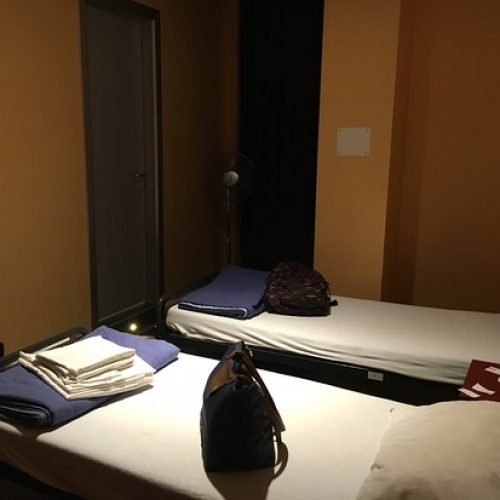
At what (x,y) coordinates should I click in order to perform the action: click on pillow on right bed. Please return your answer as a coordinate pair (x, y). The height and width of the screenshot is (500, 500). Looking at the image, I should click on (444, 456).